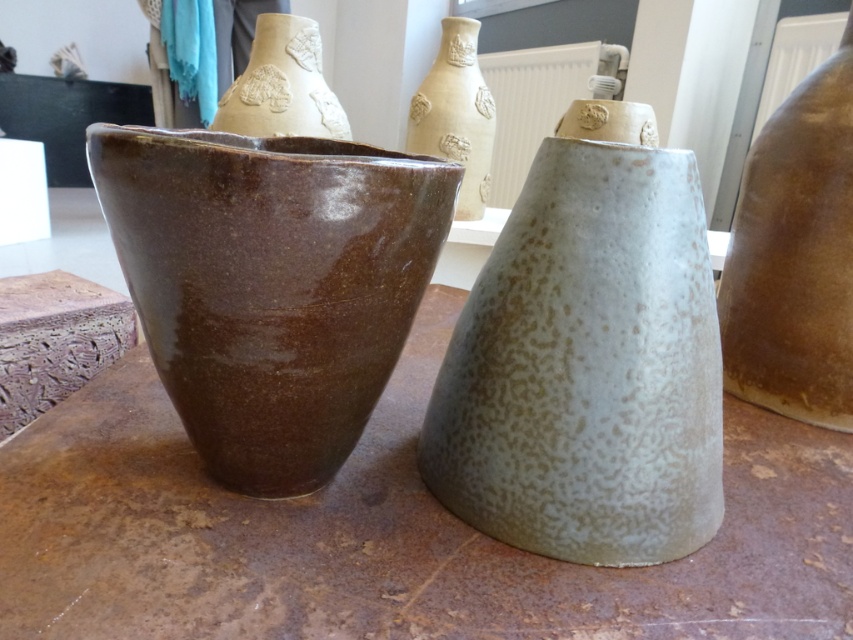
Question: Estimate the real-world distances between objects in this image. Which object is farther from the matte beige vase at upper center?

Choices:
 (A) brown glossy vase at left
 (B) brown matte vase at right
 (C) speckled ceramic vase at center

Answer: (A)

Question: Is brown matte vase at right below matte beige vase at upper center?

Choices:
 (A) yes
 (B) no

Answer: (A)

Question: Estimate the real-world distances between objects in this image. Which object is closer to the speckled ceramic vase at center?

Choices:
 (A) brown glossy vase at left
 (B) brown matte vase at right
 (C) matte beige vase at upper center

Answer: (A)

Question: Does brown glossy vase at left have a lesser width compared to brown matte vase at right?

Choices:
 (A) no
 (B) yes

Answer: (A)

Question: Which object appears closest to the camera in this image?

Choices:
 (A) matte beige vase at upper center
 (B) brown matte vase at right
 (C) speckled ceramic vase at center

Answer: (C)

Question: Is speckled ceramic vase at center bigger than matte beige vase at upper center?

Choices:
 (A) no
 (B) yes

Answer: (A)